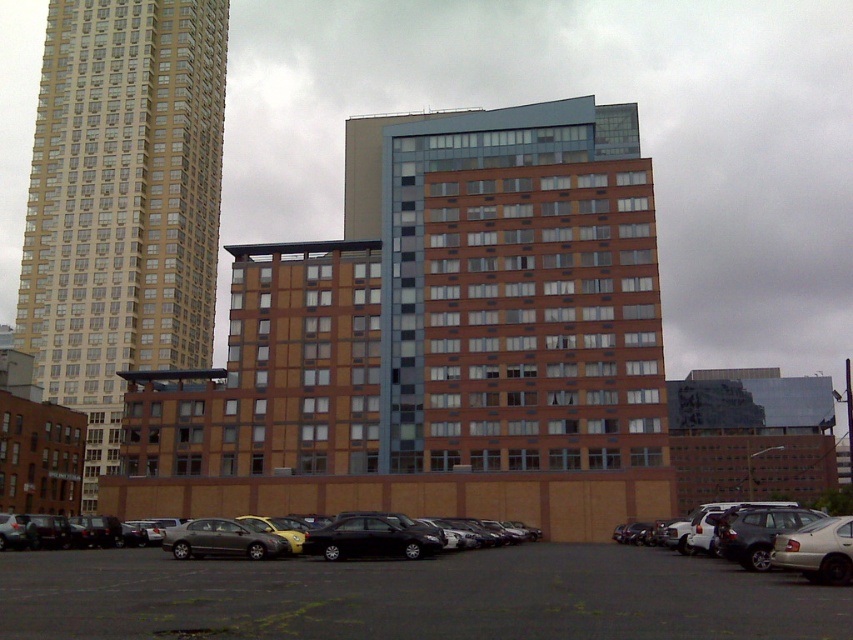
Question: Does black asphalt parking lot at lower center appear on the right side of silver metallic suv at lower right?

Choices:
 (A) yes
 (B) no

Answer: (B)

Question: Does black matte car at lower center appear under silver metallic suv at lower right?

Choices:
 (A) no
 (B) yes

Answer: (B)

Question: Which point is closer to the camera?

Choices:
 (A) silver metallic suv at lower right
 (B) matte gold building at left

Answer: (A)

Question: Which point appears closest to the camera in this image?

Choices:
 (A) (36, 563)
 (B) (254, 528)

Answer: (A)

Question: Does black asphalt parking lot at lower center have a smaller size compared to black matte car at lower center?

Choices:
 (A) no
 (B) yes

Answer: (A)

Question: Which point is farther from the camera taking this photo?

Choices:
 (A) (793, 593)
 (B) (723, 513)
 (C) (248, 529)

Answer: (B)